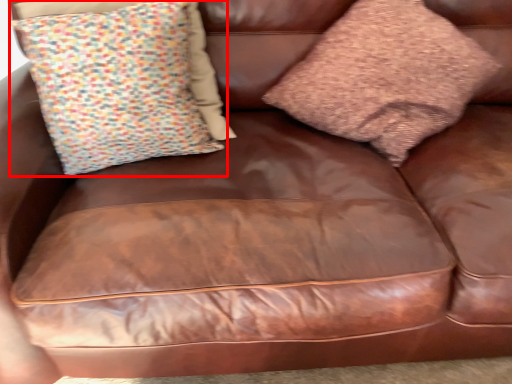
Question: From the image, what is the correct spatial relationship of pillow (annotated by the red box) in relation to pillow?

Choices:
 (A) right
 (B) left

Answer: (B)